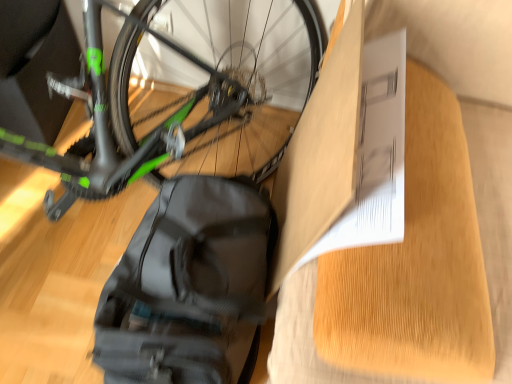
Question: Is matte cardboard box at center far away from white paper at upper right?

Choices:
 (A) yes
 (B) no

Answer: (B)

Question: Is matte cardboard box at center not within white paper at upper right?

Choices:
 (A) no
 (B) yes

Answer: (A)

Question: Is matte cardboard box at center oriented towards white paper at upper right?

Choices:
 (A) yes
 (B) no

Answer: (A)

Question: From the image's perspective, is matte cardboard box at center on top of white paper at upper right?

Choices:
 (A) yes
 (B) no

Answer: (A)

Question: Does matte cardboard box at center have a greater height compared to white paper at upper right?

Choices:
 (A) yes
 (B) no

Answer: (B)

Question: From the image's perspective, is matte cardboard box at center located above or below black matte backpack at lower left?

Choices:
 (A) below
 (B) above

Answer: (B)

Question: Considering the positions of matte cardboard box at center and black matte backpack at lower left in the image, is matte cardboard box at center wider or thinner than black matte backpack at lower left?

Choices:
 (A) thin
 (B) wide

Answer: (A)

Question: Do you think matte cardboard box at center is within black matte backpack at lower left, or outside of it?

Choices:
 (A) inside
 (B) outside

Answer: (B)

Question: Is point (287, 266) positioned closer to the camera than point (118, 311)?

Choices:
 (A) closer
 (B) farther

Answer: (A)

Question: From the image's perspective, is black matte backpack at lower left positioned above or below matte cardboard box at center?

Choices:
 (A) above
 (B) below

Answer: (B)

Question: From their relative heights in the image, would you say black matte backpack at lower left is taller or shorter than matte cardboard box at center?

Choices:
 (A) short
 (B) tall

Answer: (A)

Question: In terms of width, does black matte backpack at lower left look wider or thinner when compared to matte cardboard box at center?

Choices:
 (A) wide
 (B) thin

Answer: (A)

Question: Is point (147, 233) positioned closer to the camera than point (343, 61)?

Choices:
 (A) closer
 (B) farther

Answer: (B)

Question: In terms of height, does black matte backpack at lower left look taller or shorter compared to white paper at upper right?

Choices:
 (A) tall
 (B) short

Answer: (B)

Question: Do you think black matte backpack at lower left is within white paper at upper right, or outside of it?

Choices:
 (A) outside
 (B) inside

Answer: (A)